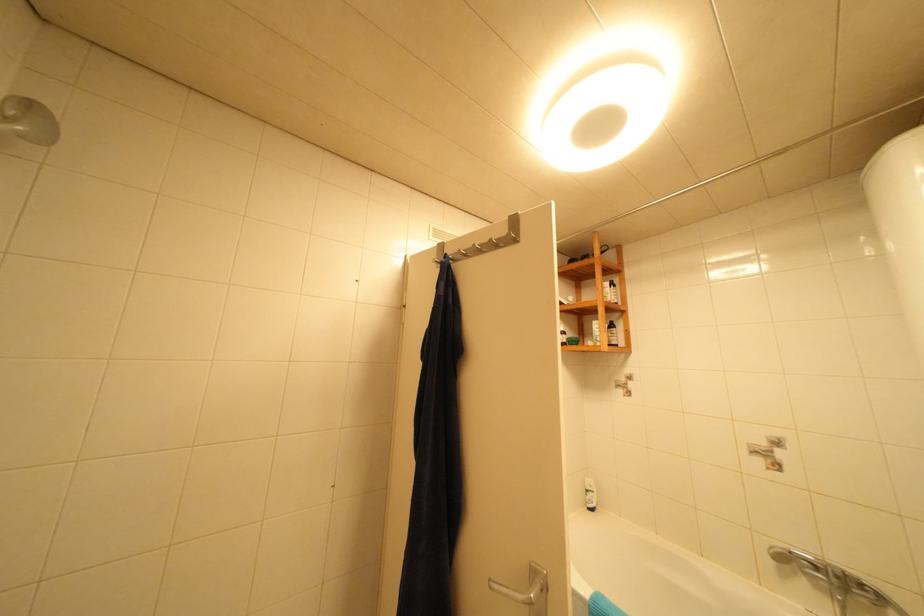
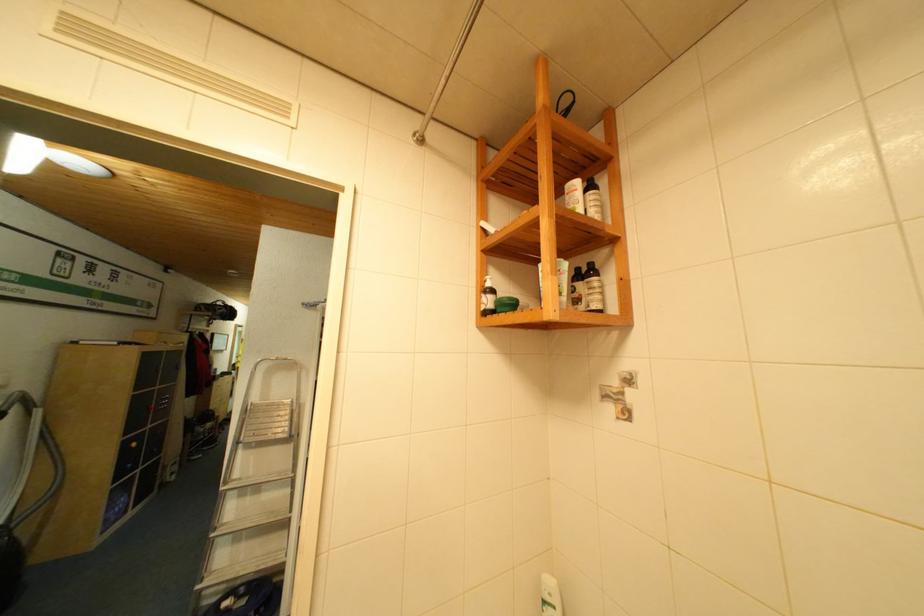
The point at (x=596, y=492) is marked in the first image. Where is the corresponding point in the second image?

(553, 602)